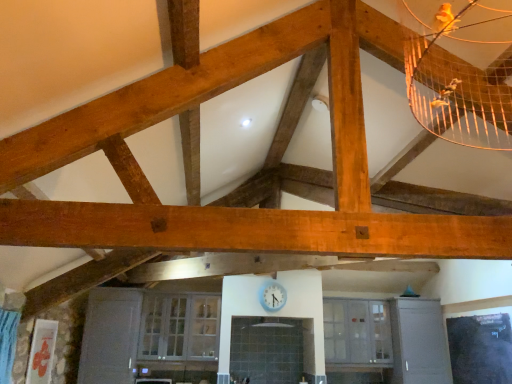
In order to face blue glossy clock at center, should I rotate leftwards or rightwards?

You should look right and rotate roughly 2.168 degrees.

Based on the photo, how much space does clear glass cabinet at center, which ranks as the first window in right-to-left order, occupy horizontally?

clear glass cabinet at center, which ranks as the first window in right-to-left order, is 40.81 centimeters in width.

From the picture: What is the approximate width of clear glass cabinet at lower center, the 2th window when ordered from right to left?

clear glass cabinet at lower center, the 2th window when ordered from right to left, is 17.72 inches in width.

The image size is (512, 384). I want to click on blue glossy clock at center, so click(272, 296).

Could you tell me if clear glass cabinet at center, marked as the second window in a left-to-right arrangement, is facing clear glass cabinet at lower center, which is the first window in left-to-right order?

No, clear glass cabinet at center, marked as the second window in a left-to-right arrangement, is not facing towards clear glass cabinet at lower center, which is the first window in left-to-right order.

Can you confirm if clear glass cabinet at center, marked as the second window in a left-to-right arrangement, is wider than clear glass cabinet at lower center, the 2th window when ordered from right to left?

No.

Are clear glass cabinet at center, which ranks as the first window in right-to-left order, and clear glass cabinet at lower center, the 2th window when ordered from right to left, located far from each other?

Yes, clear glass cabinet at center, which ranks as the first window in right-to-left order, and clear glass cabinet at lower center, the 2th window when ordered from right to left, are quite far apart.

Can you confirm if clear glass cabinet at lower center, the 2th window when ordered from right to left, is positioned to the left of clear glass cabinet at center, marked as the second window in a left-to-right arrangement?

Yes.

Could you tell me if clear glass cabinet at lower center, which is the first window in left-to-right order, is turned towards clear glass cabinet at center, marked as the second window in a left-to-right arrangement?

No, clear glass cabinet at lower center, which is the first window in left-to-right order, is not aimed at clear glass cabinet at center, marked as the second window in a left-to-right arrangement.

Based on the photo, from a real-world perspective, is clear glass cabinet at lower center, the 2th window when ordered from right to left, located higher than clear glass cabinet at center, marked as the second window in a left-to-right arrangement?

Incorrect, from a real-world perspective, clear glass cabinet at lower center, the 2th window when ordered from right to left, is lower than clear glass cabinet at center, marked as the second window in a left-to-right arrangement.

Considering the relative sizes of clear glass cabinet at lower center, which is the first window in left-to-right order, and clear glass cabinet at center, which ranks as the first window in right-to-left order, in the image provided, is clear glass cabinet at lower center, which is the first window in left-to-right order, wider than clear glass cabinet at center, which ranks as the first window in right-to-left order,?

Indeed, clear glass cabinet at lower center, which is the first window in left-to-right order, has a greater width compared to clear glass cabinet at center, which ranks as the first window in right-to-left order.

At what (x,y) coordinates should I click in order to perform the action: click on window that is the 1st object located below the blue glossy clock at center (from the image's perspective). Please return your answer as a coordinate pair (x, y). This screenshot has height=384, width=512. Looking at the image, I should click on (179, 327).

Between clear glass cabinet at lower center, which is the first window in left-to-right order, and blue glossy clock at center, which one appears on the left side from the viewer's perspective?

clear glass cabinet at lower center, which is the first window in left-to-right order, is more to the left.

Does clear glass cabinet at lower center, which is the first window in left-to-right order, have a smaller size compared to blue glossy clock at center?

No, clear glass cabinet at lower center, which is the first window in left-to-right order, is not smaller than blue glossy clock at center.

What's the angular difference between clear glass cabinet at lower center, the 2th window when ordered from right to left, and blue glossy clock at center's facing directions?

The angular difference between clear glass cabinet at lower center, the 2th window when ordered from right to left, and blue glossy clock at center is 1.48 degrees.

Which object is wider, blue glossy clock at center or clear glass cabinet at center, which ranks as the first window in right-to-left order?

clear glass cabinet at center, which ranks as the first window in right-to-left order.

Is point (272, 300) farther from camera compared to point (351, 303)?

No.

From a real-world perspective, is blue glossy clock at center above or below clear glass cabinet at center, marked as the second window in a left-to-right arrangement?

blue glossy clock at center is situated higher than clear glass cabinet at center, marked as the second window in a left-to-right arrangement, in the real world.

Does blue glossy clock at center have a larger size compared to clear glass cabinet at center, which ranks as the first window in right-to-left order?

Actually, blue glossy clock at center might be smaller than clear glass cabinet at center, which ranks as the first window in right-to-left order.

From the image's perspective, starting from the blue glossy clock at center, which window is the 1st one below? Please provide its 2D coordinates.

[(179, 327)]

Considering the relative positions of blue glossy clock at center and clear glass cabinet at lower center, which is the first window in left-to-right order, in the image provided, is blue glossy clock at center to the left of clear glass cabinet at lower center, which is the first window in left-to-right order, from the viewer's perspective?

No, blue glossy clock at center is not to the left of clear glass cabinet at lower center, which is the first window in left-to-right order.

From the image's perspective, is blue glossy clock at center located above clear glass cabinet at lower center, which is the first window in left-to-right order?

Yes, from the image's perspective, blue glossy clock at center is on top of clear glass cabinet at lower center, which is the first window in left-to-right order.

Considering the relative sizes of clear glass cabinet at center, marked as the second window in a left-to-right arrangement, and blue glossy clock at center in the image provided, is clear glass cabinet at center, marked as the second window in a left-to-right arrangement, shorter than blue glossy clock at center?

In fact, clear glass cabinet at center, marked as the second window in a left-to-right arrangement, may be taller than blue glossy clock at center.

Is clear glass cabinet at center, which ranks as the first window in right-to-left order, not near blue glossy clock at center?

Yes, clear glass cabinet at center, which ranks as the first window in right-to-left order, and blue glossy clock at center are quite far apart.

Who is bigger, clear glass cabinet at center, marked as the second window in a left-to-right arrangement, or blue glossy clock at center?

Bigger between the two is clear glass cabinet at center, marked as the second window in a left-to-right arrangement.

Does clear glass cabinet at center, marked as the second window in a left-to-right arrangement, come in front of blue glossy clock at center?

No, it is behind blue glossy clock at center.

Where is `window to the left of clear glass cabinet at center, marked as the second window in a left-to-right arrangement`? The image size is (512, 384). window to the left of clear glass cabinet at center, marked as the second window in a left-to-right arrangement is located at coordinates (179, 327).

I want to click on window that appears above the clear glass cabinet at lower center, the 2th window when ordered from right to left (from a real-world perspective), so click(357, 331).

Based on the photo, based on their spatial positions, is clear glass cabinet at lower center, the 2th window when ordered from right to left, or blue glossy clock at center further from clear glass cabinet at center, which ranks as the first window in right-to-left order?

Among the two, clear glass cabinet at lower center, the 2th window when ordered from right to left, is located further to clear glass cabinet at center, which ranks as the first window in right-to-left order.

In the scene shown: Which object lies further to the anchor point blue glossy clock at center, clear glass cabinet at center, which ranks as the first window in right-to-left order, or clear glass cabinet at lower center, which is the first window in left-to-right order?

clear glass cabinet at lower center, which is the first window in left-to-right order, lies further to blue glossy clock at center than the other object.

Considering their positions, is blue glossy clock at center positioned further to clear glass cabinet at center, which ranks as the first window in right-to-left order, than clear glass cabinet at lower center, the 2th window when ordered from right to left?

clear glass cabinet at lower center, the 2th window when ordered from right to left, is further to clear glass cabinet at center, which ranks as the first window in right-to-left order.

When comparing their distances from blue glossy clock at center, does clear glass cabinet at lower center, the 2th window when ordered from right to left, or clear glass cabinet at center, which ranks as the first window in right-to-left order, seem closer?

clear glass cabinet at center, which ranks as the first window in right-to-left order, is closer to blue glossy clock at center.

Considering their positions, is clear glass cabinet at center, marked as the second window in a left-to-right arrangement, positioned further to clear glass cabinet at lower center, the 2th window when ordered from right to left, than blue glossy clock at center?

Based on the image, clear glass cabinet at center, marked as the second window in a left-to-right arrangement, appears to be further to clear glass cabinet at lower center, the 2th window when ordered from right to left.

Looking at the image, which one is located further to clear glass cabinet at lower center, the 2th window when ordered from right to left, blue glossy clock at center or clear glass cabinet at center, which ranks as the first window in right-to-left order?

The object further to clear glass cabinet at lower center, the 2th window when ordered from right to left, is clear glass cabinet at center, which ranks as the first window in right-to-left order.

This screenshot has height=384, width=512. In order to click on clock located between clear glass cabinet at lower center, the 2th window when ordered from right to left, and clear glass cabinet at center, which ranks as the first window in right-to-left order, in the left-right direction in this screenshot , I will do `click(272, 296)`.